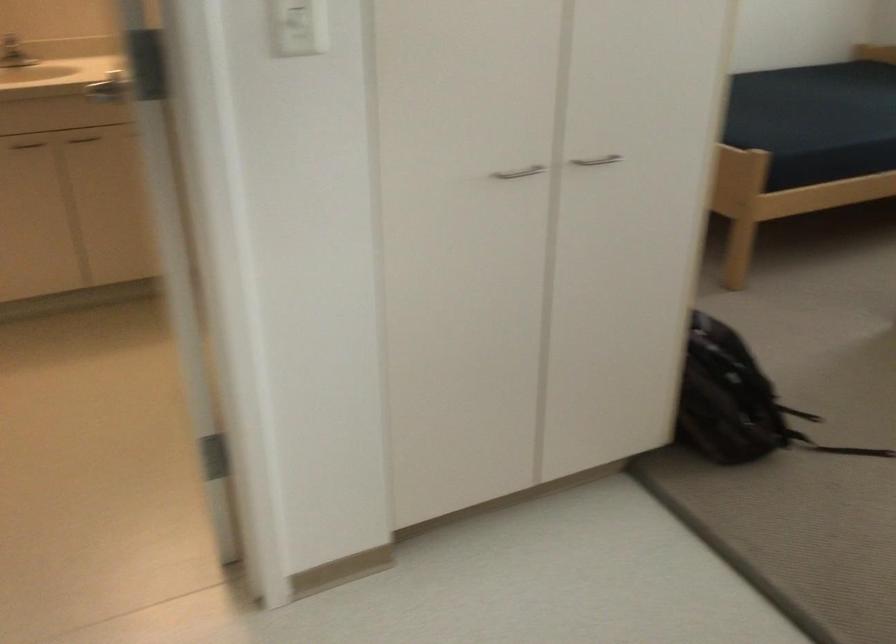
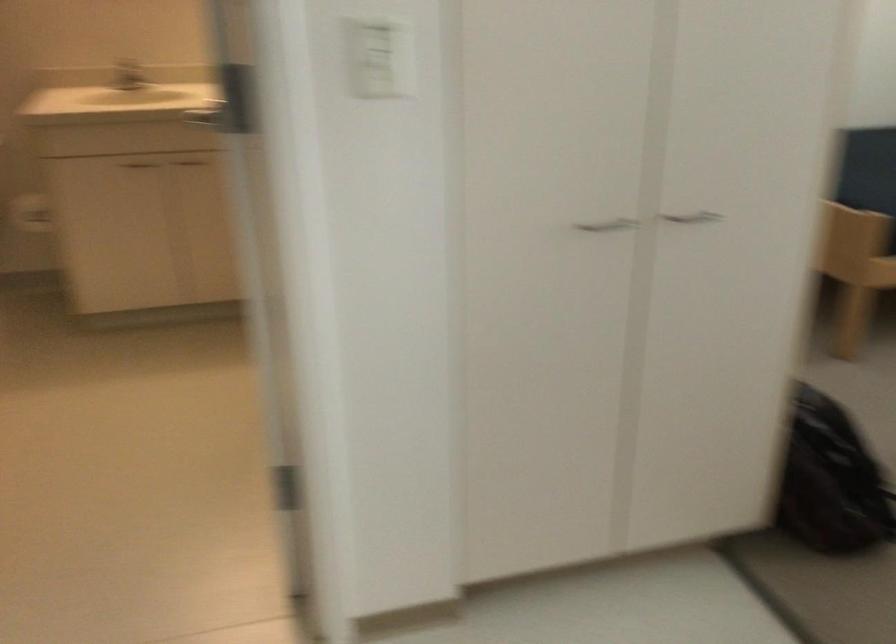
Question: The camera is either moving clockwise (left) or counter-clockwise (right) around the object. The first image is from the beginning of the video and the second image is from the end. Is the camera moving left or right when shooting the video?

Choices:
 (A) Left
 (B) Right

Answer: (B)